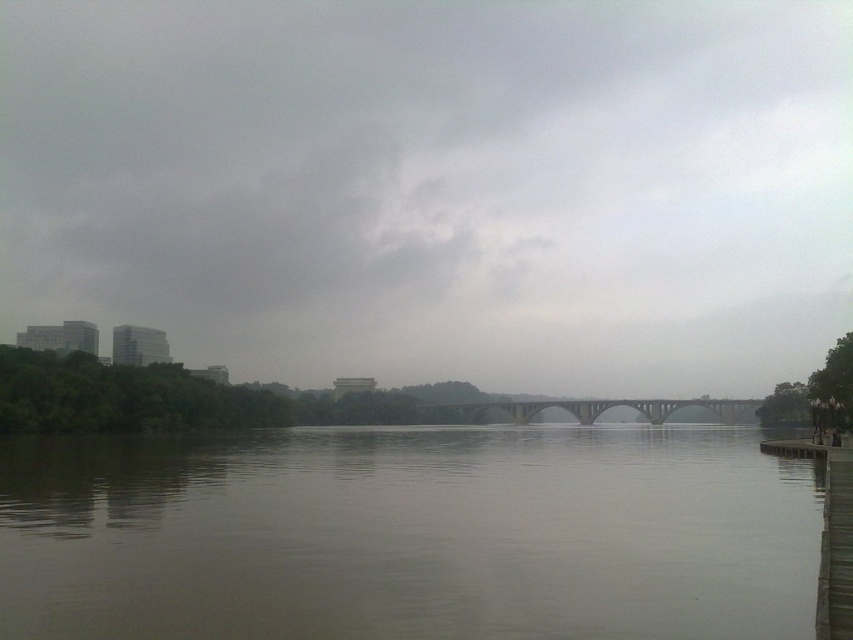
Question: Does gray cloudy sky at upper center have a smaller size compared to brown wooden dock at lower right?

Choices:
 (A) no
 (B) yes

Answer: (A)

Question: Is gray cloudy sky at upper center to the left of brown wooden dock at lower right from the viewer's perspective?

Choices:
 (A) no
 (B) yes

Answer: (B)

Question: Which of these objects is positioned farthest from the concrete bridge at center?

Choices:
 (A) brown wooden dock at lower right
 (B) brown matte water at center
 (C) gray cloudy sky at upper center

Answer: (A)

Question: Which point appears farthest from the camera in this image?

Choices:
 (A) (206, 272)
 (B) (608, 586)
 (C) (749, 408)
 (D) (844, 595)

Answer: (A)

Question: Is brown wooden dock at lower right wider than concrete bridge at center?

Choices:
 (A) yes
 (B) no

Answer: (B)

Question: Which point is closer to the camera?

Choices:
 (A) gray cloudy sky at upper center
 (B) brown matte water at center
 (C) brown wooden dock at lower right
 (D) concrete bridge at center

Answer: (C)